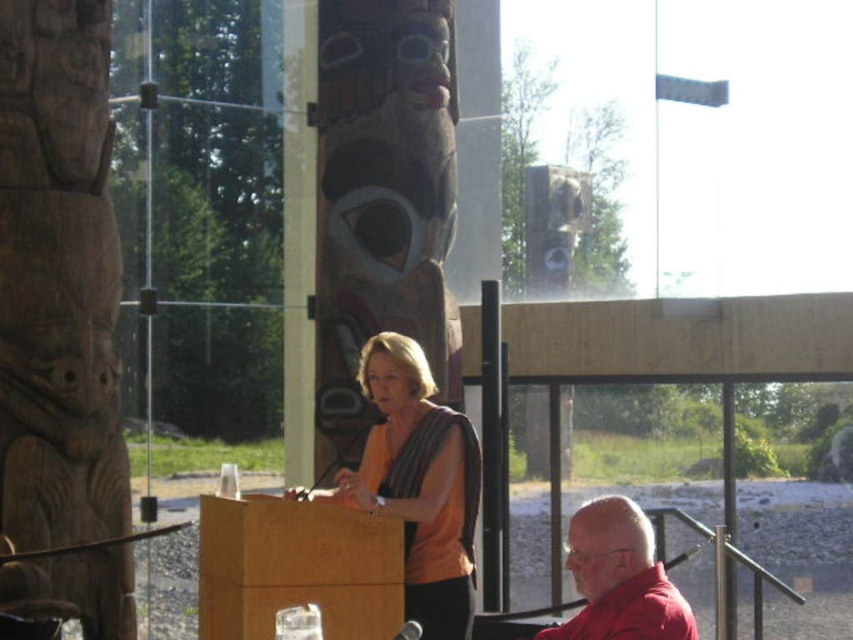
You are an event planner organizing a presentation. You need to ensure that the wooden totem pole at center and the orange matte shirt at center are both visible to the audience. Based on their sizes, which object will appear taller from the audience perspective?

The wooden totem pole at center has a greater height compared to the orange matte shirt at center, so the wooden totem pole at center will appear taller from the audience perspective.

You are a photographer trying to capture a clear shot of the wooden totem pole at center and the orange matte shirt at center. Which object is closer to the camera, and will it block the view of the other?

The wooden totem pole at center is closer to the camera than the orange matte shirt at center, so it may block the view of the orange matte shirt at center.

You are an event planner organizing a presentation in this room. You need to place a large screen behind the podium so it can be seen clearly by the audience. Which wooden totem pole should the screen be placed behind, the wooden totem pole at left or the wooden totem pole at center?

The screen should be placed behind the wooden totem pole at center because the wooden totem pole at left is below it, meaning the center pole is higher and would provide a better backdrop for visibility.